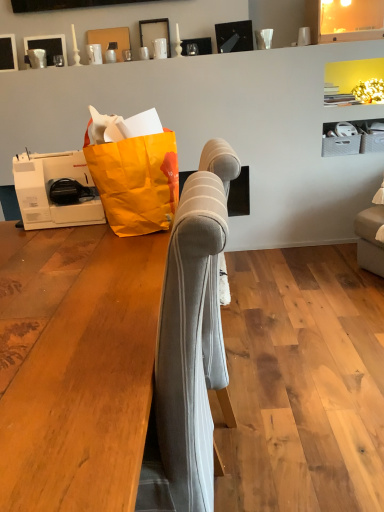
Question: Is the position of matte black picture frame at upper center, the first picture frame from the right, more distant than that of matte black picture frame at upper left, which is the 2th picture frame from left to right?

Choices:
 (A) no
 (B) yes

Answer: (A)

Question: From a real-world perspective, is matte black picture frame at upper center, the third picture frame viewed from the left, positioned under matte black picture frame at upper left, arranged as the second picture frame when viewed from the right, based on gravity?

Choices:
 (A) no
 (B) yes

Answer: (A)

Question: Is matte black picture frame at upper center, the first picture frame from the right, positioned far away from matte black picture frame at upper left, which is the 2th picture frame from left to right?

Choices:
 (A) no
 (B) yes

Answer: (A)

Question: Is matte black picture frame at upper center, the third picture frame viewed from the left, facing away from matte black picture frame at upper left, arranged as the second picture frame when viewed from the right?

Choices:
 (A) no
 (B) yes

Answer: (A)

Question: From a real-world perspective, is matte black picture frame at upper center, the third picture frame viewed from the left, physically above matte black picture frame at upper left, which is the 2th picture frame from left to right?

Choices:
 (A) yes
 (B) no

Answer: (A)

Question: Can you confirm if matte black picture frame at upper center, the third picture frame viewed from the left, is smaller than matte black picture frame at upper left, arranged as the second picture frame when viewed from the right?

Choices:
 (A) yes
 (B) no

Answer: (A)

Question: Is orange paper grocery bag at left shorter than light gray fabric sofa at center?

Choices:
 (A) yes
 (B) no

Answer: (A)

Question: Is the depth of orange paper grocery bag at left greater than that of light gray fabric sofa at center?

Choices:
 (A) yes
 (B) no

Answer: (A)

Question: Is orange paper grocery bag at left turned away from light gray fabric sofa at center?

Choices:
 (A) no
 (B) yes

Answer: (A)

Question: From a real-world perspective, is orange paper grocery bag at left below light gray fabric sofa at center?

Choices:
 (A) yes
 (B) no

Answer: (B)

Question: Is orange paper grocery bag at left bigger than light gray fabric sofa at center?

Choices:
 (A) yes
 (B) no

Answer: (B)

Question: Would you say orange paper grocery bag at left contains light gray fabric sofa at center?

Choices:
 (A) yes
 (B) no

Answer: (B)

Question: Does orange paper grocery bag at left have a greater width compared to matte black picture frame at upper left, arranged as the second picture frame when viewed from the right?

Choices:
 (A) yes
 (B) no

Answer: (A)